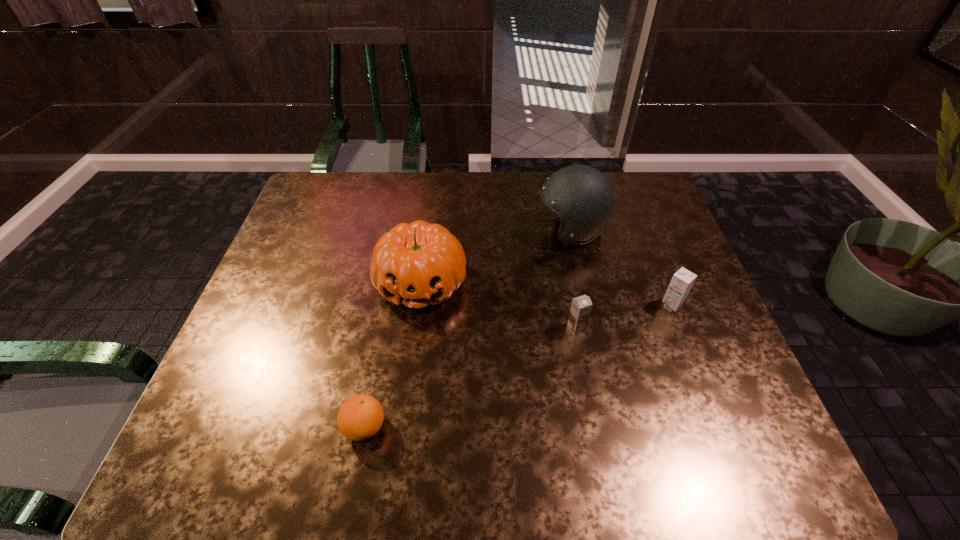
What are the coordinates of `empty space between the tallest object and the rightmost object` in the screenshot? It's located at (621, 268).

Where is `free point between the farther chocolate milk and the fourth shortest object`? The height and width of the screenshot is (540, 960). free point between the farther chocolate milk and the fourth shortest object is located at coordinates (546, 294).

The width and height of the screenshot is (960, 540). I want to click on empty space between the rightmost object and the fourth farthest object, so click(624, 317).

Locate an element on the screen. This screenshot has height=540, width=960. free spot between the left chocolate milk and the orange is located at coordinates (470, 378).

At what (x,y) coordinates should I click in order to perform the action: click on free space between the right chocolate milk and the left chocolate milk. Please return your answer as a coordinate pair (x, y). The width and height of the screenshot is (960, 540). Looking at the image, I should click on (624, 317).

Locate which object ranks in proximity to the nearer chocolate milk. Please provide its 2D coordinates. Your answer should be formatted as a tuple, i.e. [(x, y)], where the tuple contains the x and y coordinates of a point satisfying the conditions above.

[(682, 281)]

I want to click on object that is the third closest to the right chocolate milk, so click(417, 264).

Locate an element on the screen. The height and width of the screenshot is (540, 960). vacant position in the image that satisfies the following two spatial constraints: 1. at the face opening of the tallest object; 2. on the carved face of the fourth shortest object is located at coordinates (583, 282).

Where is `vacant area in the image that satisfies the following two spatial constraints: 1. on the back side of the farther chocolate milk; 2. at the face opening of the football helmet`? vacant area in the image that satisfies the following two spatial constraints: 1. on the back side of the farther chocolate milk; 2. at the face opening of the football helmet is located at coordinates (641, 230).

Locate an element on the screen. free space that satisfies the following two spatial constraints: 1. at the face opening of the tallest object; 2. on the right side of the right chocolate milk is located at coordinates (588, 306).